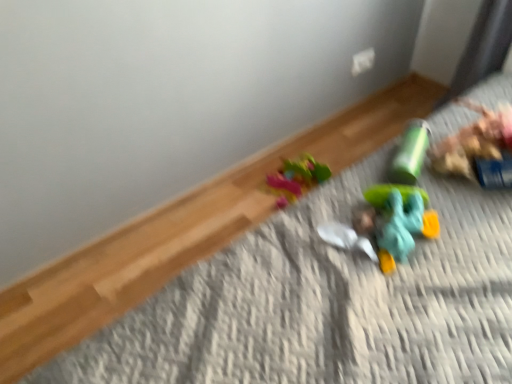
Question: Is smooth plastic head at center not inside translucent teal toy at lower right, which ranks as the 1th toy in front-to-back order?

Choices:
 (A) yes
 (B) no

Answer: (B)

Question: Is translucent teal toy at lower right, the 1th toy when ordered from bottom to top, inside smooth plastic head at center?

Choices:
 (A) yes
 (B) no

Answer: (B)

Question: Is the depth of smooth plastic head at center less than that of translucent teal toy at lower right, which is the 2th toy from top to bottom?

Choices:
 (A) no
 (B) yes

Answer: (A)

Question: Is smooth plastic head at center at the right side of translucent teal toy at lower right, which ranks as the 2th toy in back-to-front order?

Choices:
 (A) yes
 (B) no

Answer: (B)

Question: From the image's perspective, is smooth plastic head at center above translucent teal toy at lower right, which ranks as the 2th toy in back-to-front order?

Choices:
 (A) yes
 (B) no

Answer: (A)

Question: Is smooth plastic head at center wider or thinner than green matte cylinder at upper right, acting as the second toy starting from the front?

Choices:
 (A) wide
 (B) thin

Answer: (B)

Question: Would you say smooth plastic head at center is to the left or to the right of green matte cylinder at upper right, marked as the 2th toy in a bottom-to-top arrangement, in the picture?

Choices:
 (A) right
 (B) left

Answer: (B)

Question: Considering their positions, is smooth plastic head at center located in front of or behind green matte cylinder at upper right, which is counted as the first toy, starting from the back?

Choices:
 (A) front
 (B) behind

Answer: (A)

Question: In terms of height, does smooth plastic head at center look taller or shorter compared to green matte cylinder at upper right, positioned as the 1th toy in top-to-bottom order?

Choices:
 (A) tall
 (B) short

Answer: (B)

Question: Is green matte cylinder at upper right, marked as the 2th toy in a bottom-to-top arrangement, taller or shorter than translucent teal toy at lower right, the 1th toy when ordered from bottom to top?

Choices:
 (A) short
 (B) tall

Answer: (B)

Question: From a real-world perspective, is green matte cylinder at upper right, which is counted as the first toy, starting from the back, positioned above or below translucent teal toy at lower right, which ranks as the 2th toy in back-to-front order?

Choices:
 (A) above
 (B) below

Answer: (A)

Question: Would you say green matte cylinder at upper right, positioned as the 1th toy in top-to-bottom order, is inside or outside translucent teal toy at lower right, which ranks as the 1th toy in front-to-back order?

Choices:
 (A) outside
 (B) inside

Answer: (A)

Question: From the image's perspective, is green matte cylinder at upper right, which is counted as the first toy, starting from the back, above or below translucent teal toy at lower right, the 1th toy when ordered from bottom to top?

Choices:
 (A) above
 (B) below

Answer: (A)

Question: Considering the positions of translucent teal toy at lower right, which ranks as the 2th toy in back-to-front order, and green matte cylinder at upper right, positioned as the 1th toy in top-to-bottom order, in the image, is translucent teal toy at lower right, which ranks as the 2th toy in back-to-front order, bigger or smaller than green matte cylinder at upper right, positioned as the 1th toy in top-to-bottom order,?

Choices:
 (A) small
 (B) big

Answer: (B)

Question: From a real-world perspective, is translucent teal toy at lower right, the 1th toy when ordered from bottom to top, positioned above or below green matte cylinder at upper right, marked as the 2th toy in a bottom-to-top arrangement?

Choices:
 (A) above
 (B) below

Answer: (B)